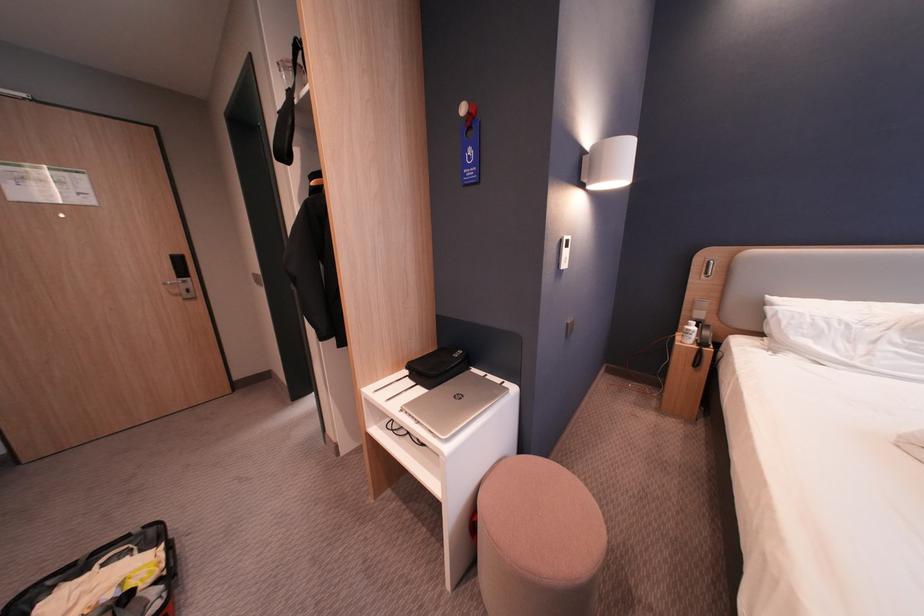
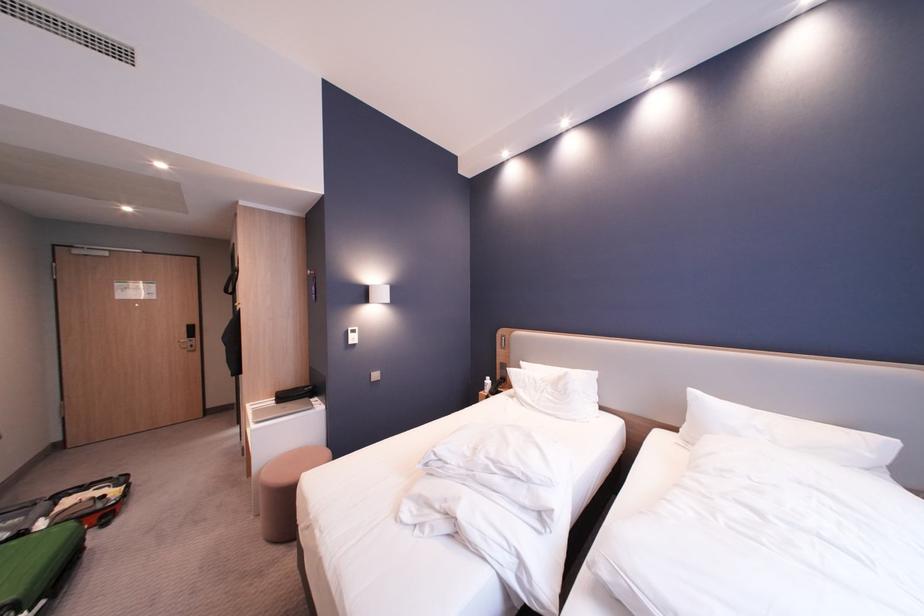
Locate, in the second image, the point that corresponds to the point at 420,383 in the first image.

(285, 403)